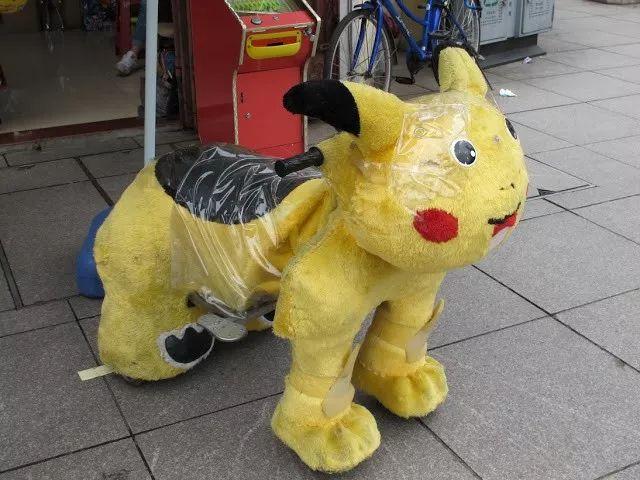
Locate an element on the screen. This screenshot has height=480, width=640. blue dustpan is located at coordinates (153, 91), (86, 274).